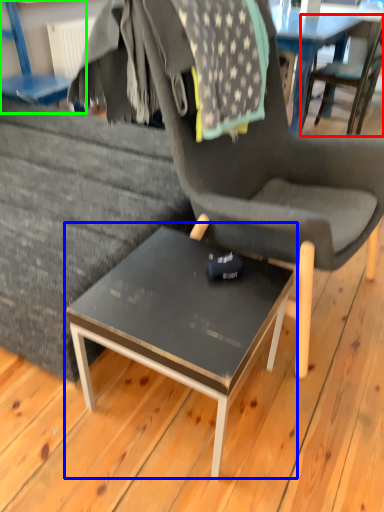
Question: Estimate the real-world distances between objects in this image. Which object is closer to chair (highlighted by a red box), coffee table (highlighted by a blue box) or chair (highlighted by a green box)?

Choices:
 (A) coffee table
 (B) chair

Answer: (B)